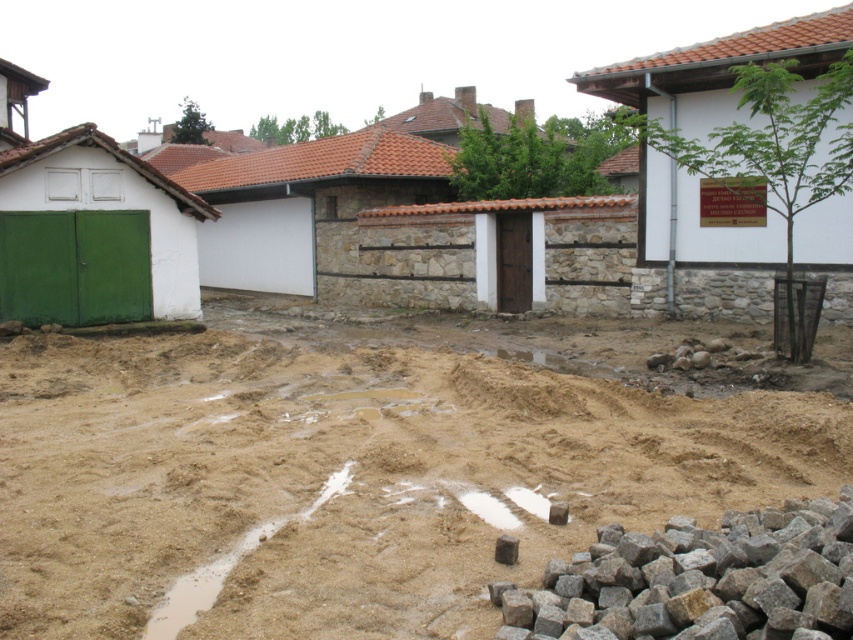
You are a delivery driver who needs to park your truck on the brown sandy dirt at center. However, there is a brown rough stone at lower right nearby. Considering the height difference between them, which area is more suitable for parking your truck?

The brown sandy dirt at center has a greater height compared to the brown rough stone at lower right, so the brown sandy dirt at center is more suitable for parking the truck as it provides a higher and possibly more stable surface.